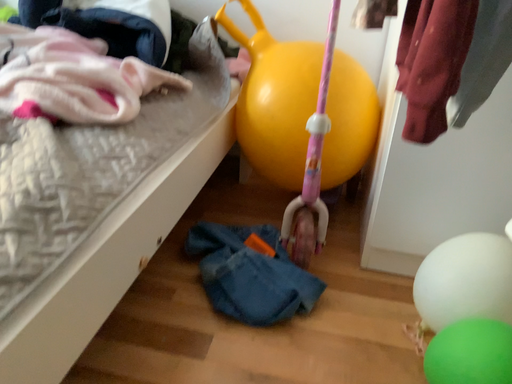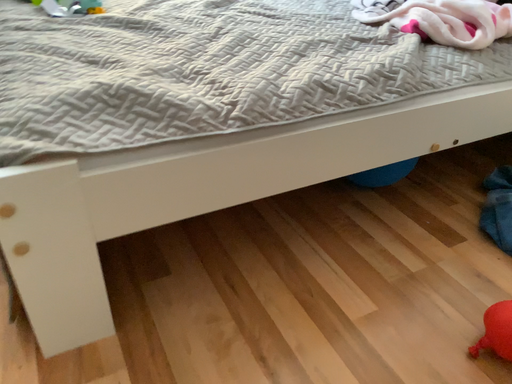
Question: How did the camera likely rotate when shooting the video?

Choices:
 (A) rotated left
 (B) rotated right

Answer: (A)